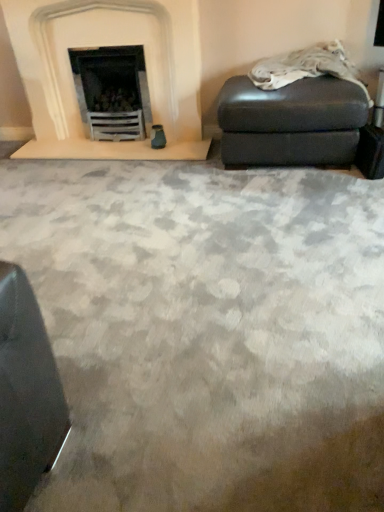
The width and height of the screenshot is (384, 512). In order to click on white stone fireplace at upper left in this screenshot , I will do `click(111, 42)`.

Where is `leather ottoman at upper right`? The image size is (384, 512). leather ottoman at upper right is located at coordinates (306, 67).

In order to face matte gray ottoman at right, should I rotate leftwards or rightwards?

Rotate right and turn 12.627 degrees.

At what (x,y) coordinates should I click in order to perform the action: click on matte gray ottoman at right. Please return your answer as a coordinate pair (x, y). This screenshot has width=384, height=512. Looking at the image, I should click on (291, 122).

Locate an element on the screen. The image size is (384, 512). white stone fireplace at upper left is located at coordinates (111, 42).

How many degrees apart are the facing directions of matte gray ottoman at right and leather ottoman at upper right?

There is a 0.817-degree angle between the facing directions of matte gray ottoman at right and leather ottoman at upper right.

Is matte gray ottoman at right situated inside leather ottoman at upper right or outside?

matte gray ottoman at right lies outside leather ottoman at upper right.

From the image's perspective, relative to leather ottoman at upper right, is matte gray ottoman at right above or below?

matte gray ottoman at right is below leather ottoman at upper right.

Who is shorter, leather ottoman at upper right or matte gray ottoman at right?

leather ottoman at upper right is shorter.

Is matte gray ottoman at right completely or partially inside leather ottoman at upper right?

No, matte gray ottoman at right is not a part of leather ottoman at upper right.

Visually, is leather ottoman at upper right positioned to the left or to the right of matte gray ottoman at right?

In the image, leather ottoman at upper right appears on the right side of matte gray ottoman at right.

Can you confirm if leather ottoman at upper right is bigger than matte gray ottoman at right?

No, leather ottoman at upper right is not bigger than matte gray ottoman at right.

From the image's perspective, who appears lower, leather ottoman at upper right or white stone fireplace at upper left?

leather ottoman at upper right, from the image's perspective.

Is white stone fireplace at upper left at the back of leather ottoman at upper right?

No, leather ottoman at upper right's orientation is not away from white stone fireplace at upper left.

Does leather ottoman at upper right contain white stone fireplace at upper left?

No, white stone fireplace at upper left is located outside of leather ottoman at upper right.

At what (x,y) coordinates should I click in order to perform the action: click on material below the white stone fireplace at upper left (from the image's perspective). Please return your answer as a coordinate pair (x, y). The height and width of the screenshot is (512, 384). Looking at the image, I should click on tap(306, 67).

Does matte gray ottoman at right have a lesser height compared to white stone fireplace at upper left?

Indeed, matte gray ottoman at right has a lesser height compared to white stone fireplace at upper left.

Looking at this image, choose the correct answer: Is matte gray ottoman at right inside white stone fireplace at upper left or outside it?

matte gray ottoman at right is spatially situated outside white stone fireplace at upper left.

Is matte gray ottoman at right turned away from white stone fireplace at upper left?

matte gray ottoman at right does not have its back to white stone fireplace at upper left.

Is white stone fireplace at upper left positioned in front of leather ottoman at upper right?

That is False.

Is white stone fireplace at upper left aimed at leather ottoman at upper right?

No.

From the image's perspective, which is above, white stone fireplace at upper left or leather ottoman at upper right?

white stone fireplace at upper left is shown above in the image.

Based on the photo, is white stone fireplace at upper left turned away from matte gray ottoman at right?

No, white stone fireplace at upper left is not facing the opposite direction of matte gray ottoman at right.

Is point (12, 30) positioned before point (252, 163)?

No, (12, 30) is behind (252, 163).

From the image's perspective, is white stone fireplace at upper left located above or below matte gray ottoman at right?

Based on their image positions, white stone fireplace at upper left is located above matte gray ottoman at right.

Identify the location of fireplace that is behind the matte gray ottoman at right. This screenshot has height=512, width=384. (111, 42).

You are a GUI agent. You are given a task and a screenshot of the screen. Output one action in this format:
    pyautogui.click(x=<x>, y=<y>)
    Task: Click on the stool that appears behind the leather ottoman at upper right
    
    Given the screenshot: What is the action you would take?
    pyautogui.click(x=291, y=122)

The image size is (384, 512). In order to click on material in front of the matte gray ottoman at right in this screenshot , I will do `click(306, 67)`.

Consider the image. Estimate the real-world distances between objects in this image. Which object is further from white stone fireplace at upper left, leather ottoman at upper right or matte gray ottoman at right?

Among the two, leather ottoman at upper right is located further to white stone fireplace at upper left.

Looking at the image, which one is located closer to white stone fireplace at upper left, matte gray ottoman at right or leather ottoman at upper right?

matte gray ottoman at right lies closer to white stone fireplace at upper left than the other object.

Estimate the real-world distances between objects in this image. Which object is closer to leather ottoman at upper right, matte gray ottoman at right or white stone fireplace at upper left?

matte gray ottoman at right lies closer to leather ottoman at upper right than the other object.

Based on their spatial positions, is white stone fireplace at upper left or matte gray ottoman at right further from leather ottoman at upper right?

The object further to leather ottoman at upper right is white stone fireplace at upper left.

Looking at the image, which one is located closer to matte gray ottoman at right, white stone fireplace at upper left or leather ottoman at upper right?

Based on the image, leather ottoman at upper right appears to be nearer to matte gray ottoman at right.

Looking at the image, which one is located further to matte gray ottoman at right, leather ottoman at upper right or white stone fireplace at upper left?

white stone fireplace at upper left.

Where is `stool between white stone fireplace at upper left and leather ottoman at upper right in the horizontal direction`? The height and width of the screenshot is (512, 384). stool between white stone fireplace at upper left and leather ottoman at upper right in the horizontal direction is located at coordinates (291, 122).